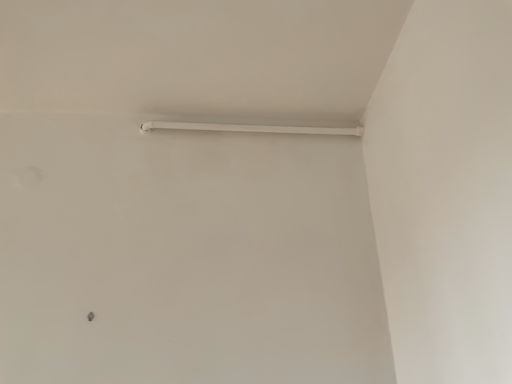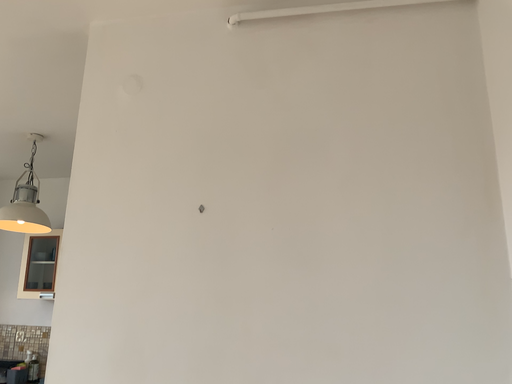
Question: Which way did the camera rotate in the video?

Choices:
 (A) rotated right
 (B) rotated left

Answer: (B)